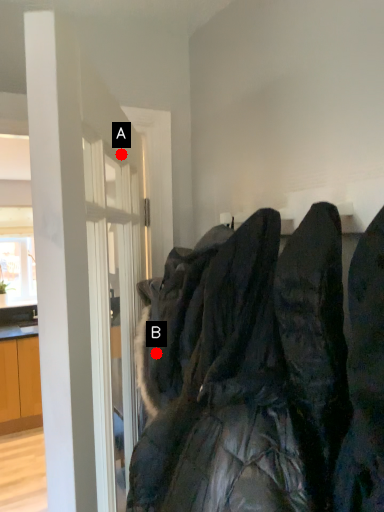
Question: Two points are circled on the image, labeled by A and B beside each circle. Which point is farther from the camera taking this photo?

Choices:
 (A) A is further
 (B) B is further

Answer: (A)